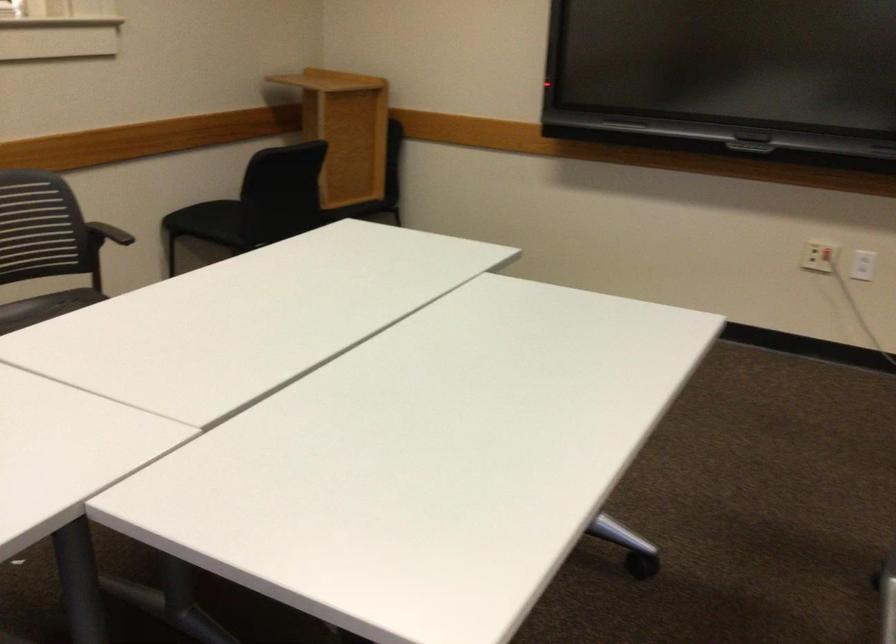
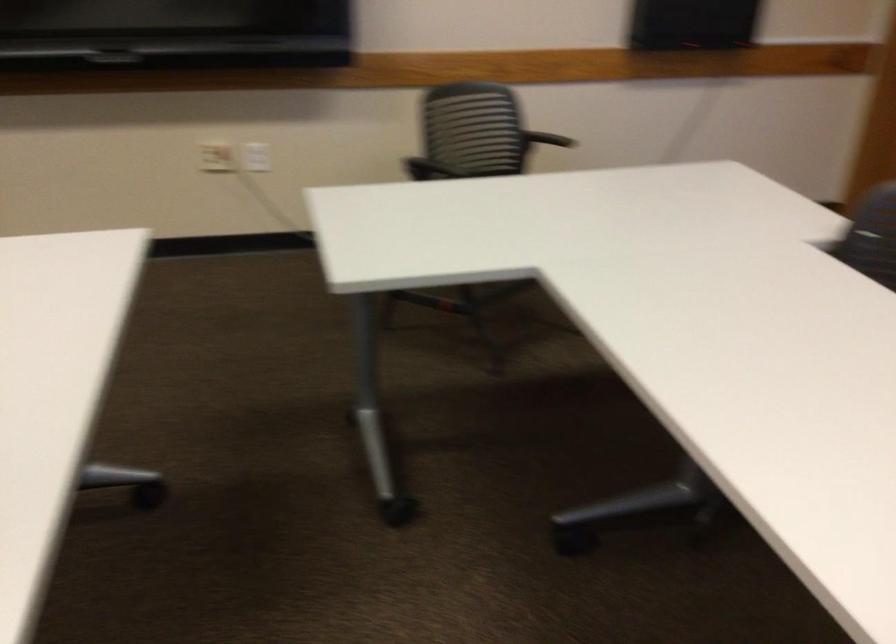
Where in the second image is the point corresponding to pixel 797 252 from the first image?

(216, 156)